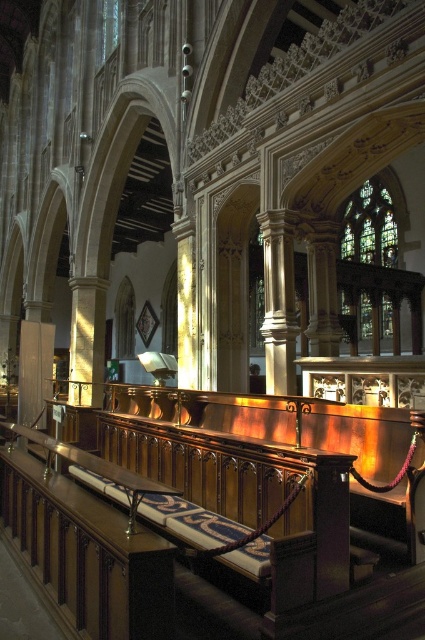
Does polished stone column at center appear over stained glass window at upper right?

No, polished stone column at center is not above stained glass window at upper right.

Is polished stone column at center shorter than stained glass window at upper right?

Indeed, polished stone column at center has a lesser height compared to stained glass window at upper right.

Who is more forward, (280, 362) or (362, 209)?

Point (280, 362)

Where is `polished stone column at center`? The image size is (425, 640). polished stone column at center is located at coordinates (278, 301).

Is polished wood church bench at center shorter than stained glass window at upper right?

Yes.

Looking at this image, between polished wood church bench at center and stained glass window at upper right, which one appears on the left side from the viewer's perspective?

polished wood church bench at center

What are the coordinates of `polished wood church bench at center` in the screenshot? It's located at (269, 518).

Where is `polished wood church bench at center`? This screenshot has width=425, height=640. polished wood church bench at center is located at coordinates (269, 518).

Does point (329, 602) lie in front of point (280, 320)?

Yes, it is.

Can you confirm if polished wood church bench at center is thinner than polished stone column at center?

Incorrect, polished wood church bench at center's width is not less than polished stone column at center's.

Who is more forward, (85,600) or (280,228)?

Point (85,600) is more forward.

Image resolution: width=425 pixels, height=640 pixels. I want to click on polished wood church bench at center, so click(269, 518).